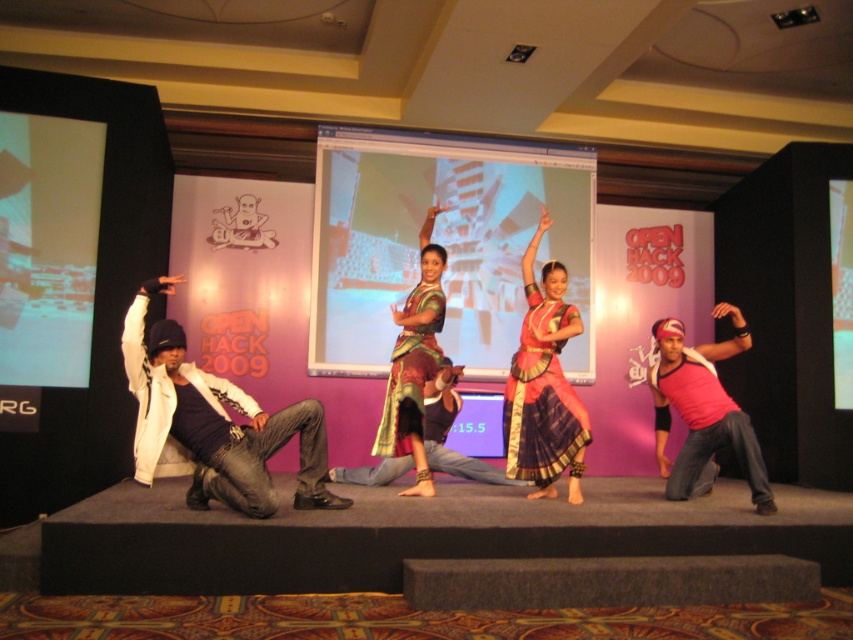
Is pink fabric shirt at center above matte brown saree at center?

Actually, pink fabric shirt at center is below matte brown saree at center.

Is point (764, 474) closer to viewer compared to point (439, 304)?

Yes, point (764, 474) is in front of point (439, 304).

Identify the location of pink fabric shirt at center. (703, 410).

Does white leather jacket at left appear on the left side of pink fabric shirt at center?

Yes, white leather jacket at left is to the left of pink fabric shirt at center.

Who is more forward, (254, 516) or (722, 356)?

Positioned in front is point (254, 516).

At what (x,y) coordinates should I click in order to perform the action: click on white leather jacket at left. Please return your answer as a coordinate pair (x, y). Looking at the image, I should click on (213, 420).

Does point (534, 451) come closer to viewer compared to point (401, 413)?

Yes, point (534, 451) is in front of point (401, 413).

Which of these two, silk sari at center or matte brown saree at center, stands shorter?

matte brown saree at center

Between point (535, 358) and point (375, 445), which one is positioned behind?

The point (375, 445) is more distant.

Locate an element on the screen. Image resolution: width=853 pixels, height=640 pixels. silk sari at center is located at coordinates (544, 385).